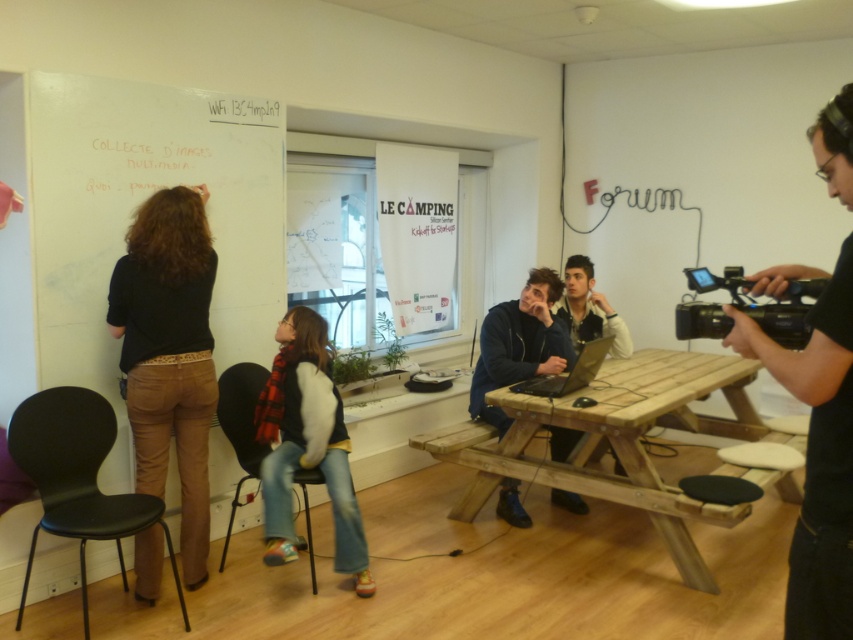
Question: Can you confirm if black plastic chair at lower left is positioned above silver metallic laptop at center?

Choices:
 (A) no
 (B) yes

Answer: (A)

Question: Which object appears closest to the camera in this image?

Choices:
 (A) black plastic chair at lower left
 (B) flannel scarf at center
 (C) black plastic video camera at right
 (D) black matte camera at right

Answer: (D)

Question: Which point is closer to the camera taking this photo?

Choices:
 (A) (201, 330)
 (B) (305, 512)
 (C) (827, 515)
 (D) (573, 333)

Answer: (C)

Question: Can you confirm if wooden picnic table at center is positioned to the right of black plastic chair at lower left?

Choices:
 (A) no
 (B) yes

Answer: (B)

Question: Based on their relative distances, which object is nearer to the flannel scarf at center?

Choices:
 (A) light brown leather jacket at center
 (B) matte black shirt at left
 (C) wooden picnic table at center
 (D) black plastic chair at center

Answer: (D)

Question: Considering the relative positions of matte black shirt at left and dark blue denim jacket at center in the image provided, where is matte black shirt at left located with respect to dark blue denim jacket at center?

Choices:
 (A) above
 (B) below

Answer: (B)